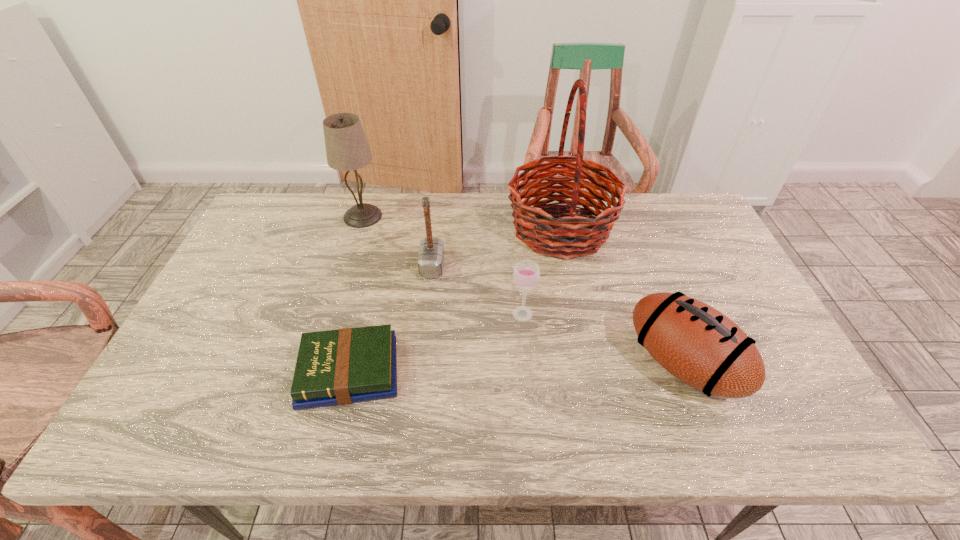
Where is `vacant space located on the front-facing side of the fifth shortest object`? vacant space located on the front-facing side of the fifth shortest object is located at coordinates (480, 216).

This screenshot has width=960, height=540. I want to click on vacant area situated 0.200m on the striking surface of the third tallest object, so click(x=511, y=266).

Where is `vacant area situated on the back of the football (American)`? This screenshot has height=540, width=960. vacant area situated on the back of the football (American) is located at coordinates (658, 298).

Find the location of a particular element. The height and width of the screenshot is (540, 960). vacant space located 0.160m on the back of the wineglass is located at coordinates (518, 265).

Locate an element on the screen. This screenshot has width=960, height=540. free space located 0.090m on the back of the shortest object is located at coordinates (364, 310).

Locate an element on the screen. Image resolution: width=960 pixels, height=540 pixels. basket positioned at the far edge is located at coordinates (572, 235).

At what (x,y) coordinates should I click in order to perform the action: click on lampshade that is at the far edge. Please return your answer as a coordinate pair (x, y). This screenshot has height=540, width=960. Looking at the image, I should click on (347, 149).

This screenshot has height=540, width=960. I want to click on football (American) present at the near edge, so click(x=699, y=345).

Image resolution: width=960 pixels, height=540 pixels. I want to click on book present at the near edge, so click(x=336, y=367).

Where is `object located in the right edge section of the desktop`? object located in the right edge section of the desktop is located at coordinates (699, 345).